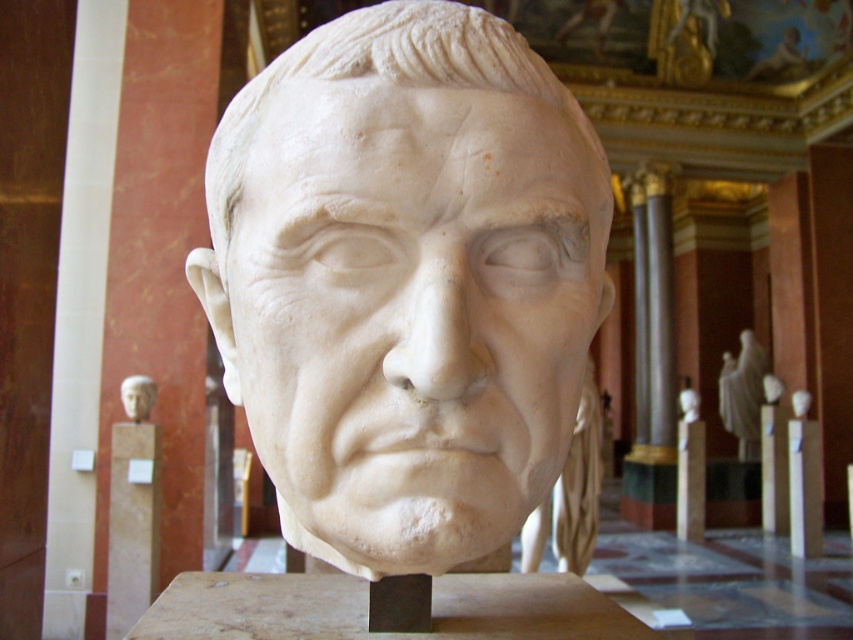
Question: Is white marble bust at center to the left of white marble head at upper left from the viewer's perspective?

Choices:
 (A) no
 (B) yes

Answer: (A)

Question: Observing the image, what is the correct spatial positioning of white marble bust at center in reference to white marble head at upper left?

Choices:
 (A) above
 (B) below

Answer: (A)

Question: Does white marble statue at center appear on the right side of white marble head at upper left?

Choices:
 (A) no
 (B) yes

Answer: (B)

Question: Which point appears farthest from the camera in this image?

Choices:
 (A) (730, 397)
 (B) (143, 401)
 (C) (549, 442)

Answer: (A)

Question: Which of the following is the farthest from the observer?

Choices:
 (A) (277, 285)
 (B) (718, 408)

Answer: (B)

Question: Which point is closer to the camera taking this photo?

Choices:
 (A) (759, 381)
 (B) (146, 394)
 (C) (451, 541)

Answer: (C)